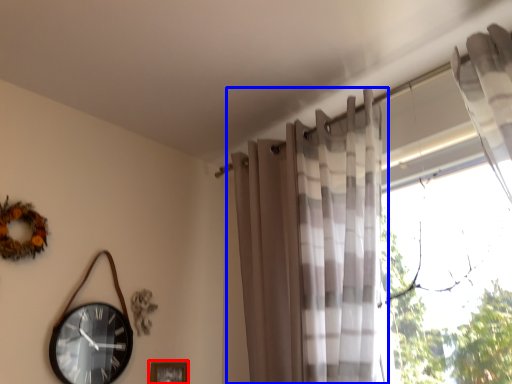
Question: Which object is further to the camera taking this photo, picture frame (highlighted by a red box) or curtain (highlighted by a blue box)?

Choices:
 (A) picture frame
 (B) curtain

Answer: (A)